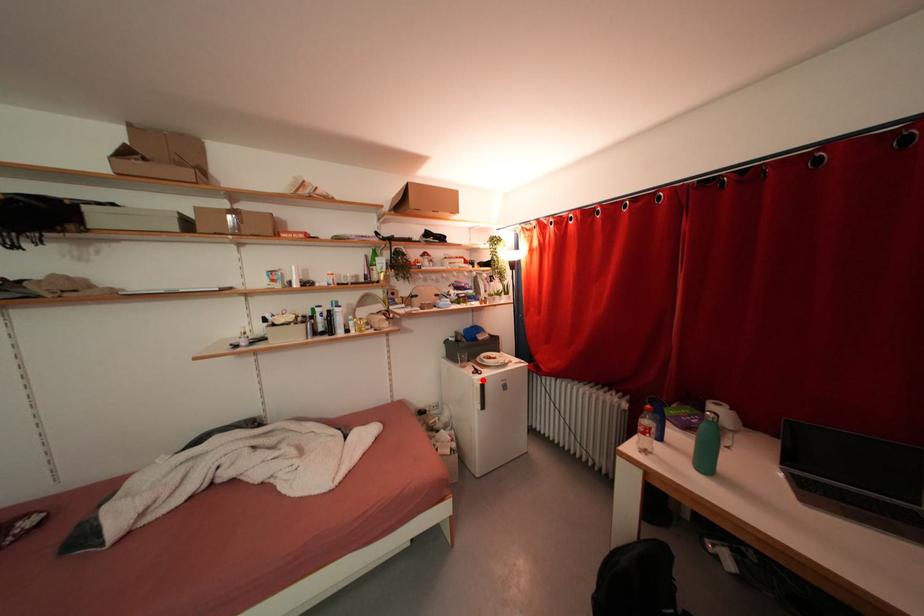
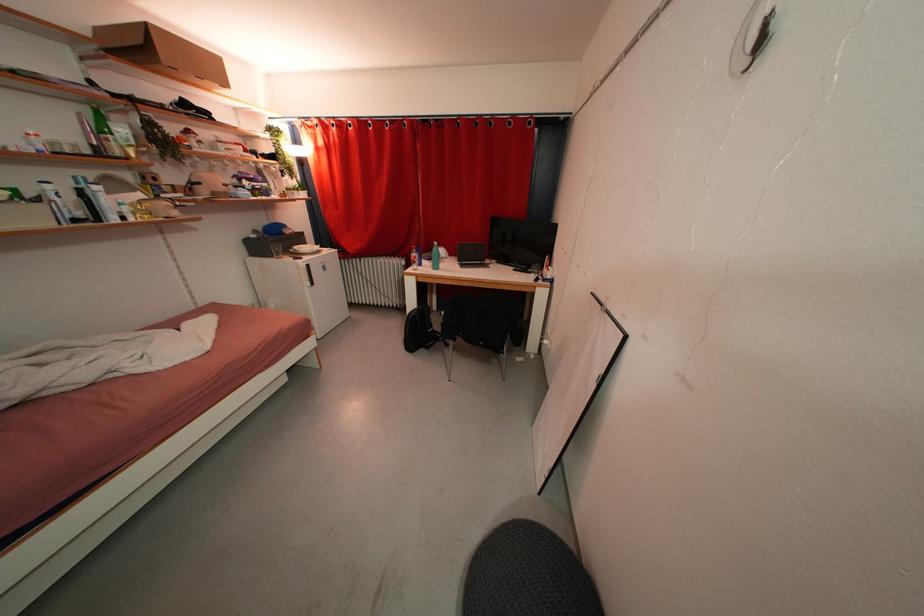
Locate, in the second image, the point that corresponds to the highlighted location in the first image.

(305, 265)